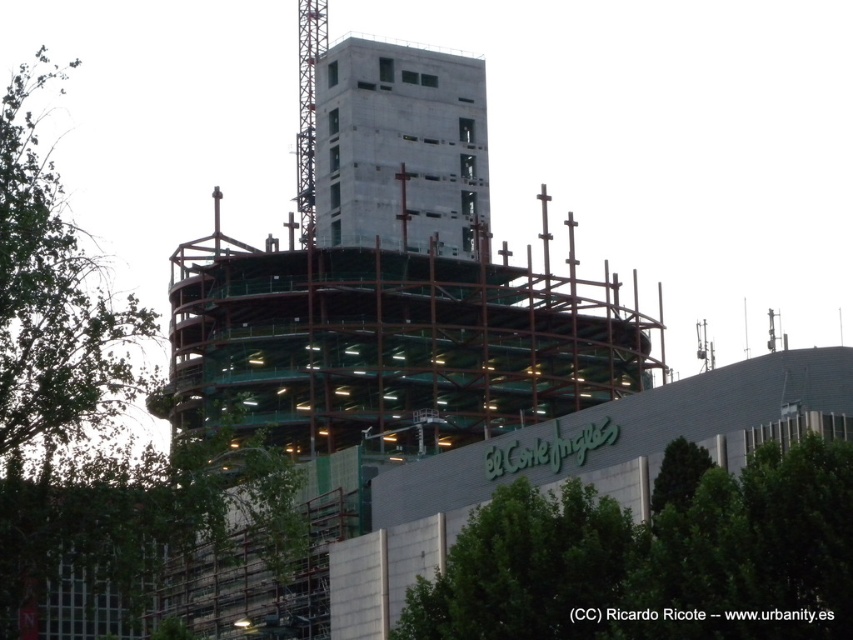
Question: Among these points, which one is farthest from the camera?

Choices:
 (A) (828, 467)
 (B) (74, 339)

Answer: (B)

Question: Is green leafy tree at left smaller than green leafy tree at lower right?

Choices:
 (A) no
 (B) yes

Answer: (A)

Question: Which is nearer to the concrete at center?

Choices:
 (A) green leafy tree at lower right
 (B) green leafy tree at left

Answer: (B)

Question: Is green leafy tree at lower right bigger than concrete at center?

Choices:
 (A) no
 (B) yes

Answer: (A)

Question: Does green leafy tree at lower right appear over concrete at center?

Choices:
 (A) no
 (B) yes

Answer: (A)

Question: Among these objects, which one is nearest to the camera?

Choices:
 (A) concrete at center
 (B) green leafy tree at left

Answer: (B)